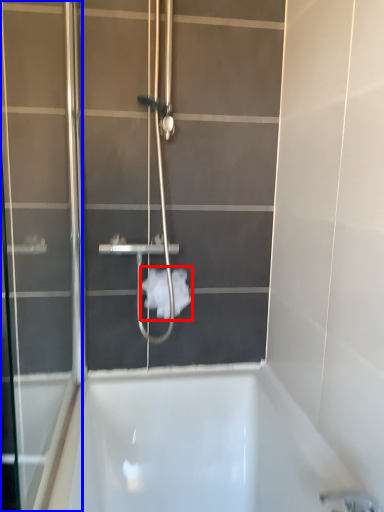
Question: Which of the following is the farthest to the observer, toilet paper (highlighted by a red box) or screen door (highlighted by a blue box)?

Choices:
 (A) toilet paper
 (B) screen door

Answer: (A)